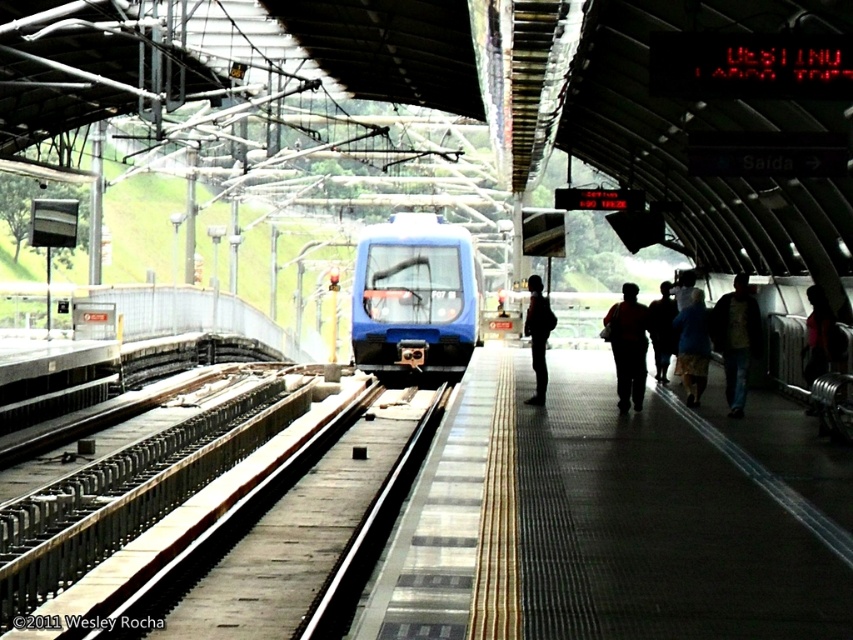
Is dark blue jeans at right wider than matte orange shirt at center?

No.

Is dark blue jeans at right taller than matte orange shirt at center?

Yes.

Which is in front, point (756, 336) or point (633, 284)?

Point (756, 336) is in front.

The width and height of the screenshot is (853, 640). Find the location of `dark blue jeans at right`. dark blue jeans at right is located at coordinates (735, 339).

Does blue glossy train at center appear over blue fabric jacket at center?

Yes, blue glossy train at center is above blue fabric jacket at center.

Does blue glossy train at center appear under blue fabric jacket at center?

No.

Between point (445, 346) and point (701, 292), which one is positioned behind?

Point (445, 346)

Identify the location of blue glossy train at center. (415, 298).

Is matte orange shirt at center thinner than blue fabric jacket at center?

No.

Can you confirm if matte orange shirt at center is taller than blue fabric jacket at center?

Yes, matte orange shirt at center is taller than blue fabric jacket at center.

I want to click on matte orange shirt at center, so click(x=628, y=346).